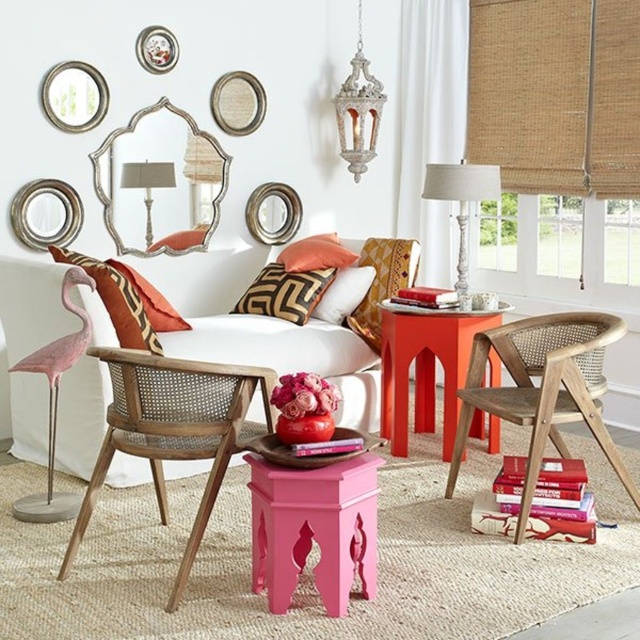
Image resolution: width=640 pixels, height=640 pixels. Describe the element at coordinates (358, 109) in the screenshot. I see `metallic lantern at upper center` at that location.

Between metallic lantern at upper center and matte gold pillow at center, which one has more height?

With more height is metallic lantern at upper center.

Find the location of a particular element. metallic lantern at upper center is located at coordinates (358, 109).

Does point (268, 296) come in front of point (330, 244)?

Yes, point (268, 296) is closer to viewer.

Who is more distant from viewer, (285, 301) or (314, 260)?

Point (314, 260)

Identify the location of goldgeometric patternpillow at center. (284, 292).

At what (x,y) coordinates should I click in order to perform the action: click on goldgeometric patternpillow at center. Please return your answer as a coordinate pair (x, y). This screenshot has height=640, width=640. Looking at the image, I should click on (284, 292).

Does matte orange side table at center have a lesser height compared to goldgeometric patternpillow at center?

Incorrect, matte orange side table at center's height does not fall short of goldgeometric patternpillow at center's.

Can you confirm if matte orange side table at center is taller than goldgeometric patternpillow at center?

Yes, matte orange side table at center is taller than goldgeometric patternpillow at center.

Is point (464, 358) farther from camera compared to point (321, 280)?

No, it is in front of (321, 280).

Image resolution: width=640 pixels, height=640 pixels. In order to click on matte orange side table at center in this screenshot , I will do pos(426,365).